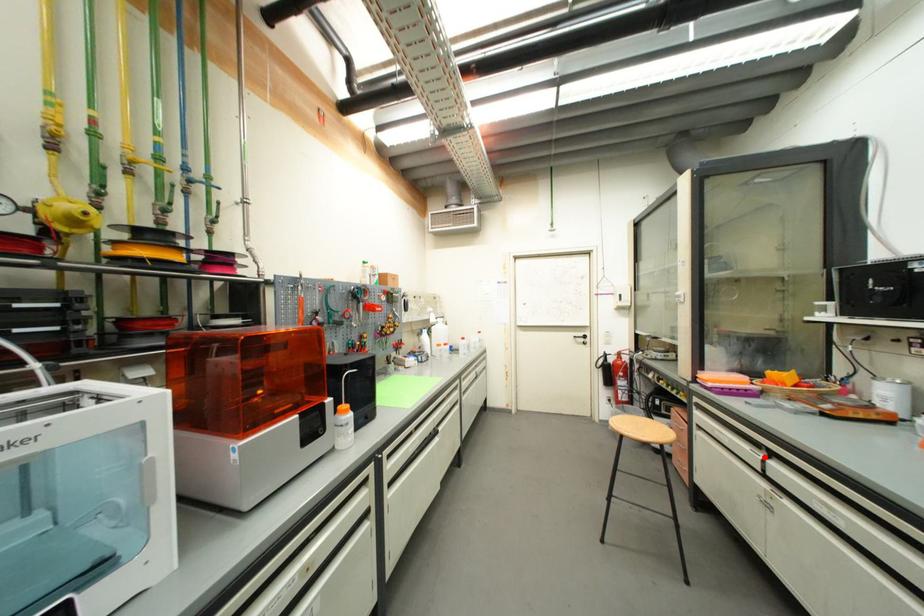
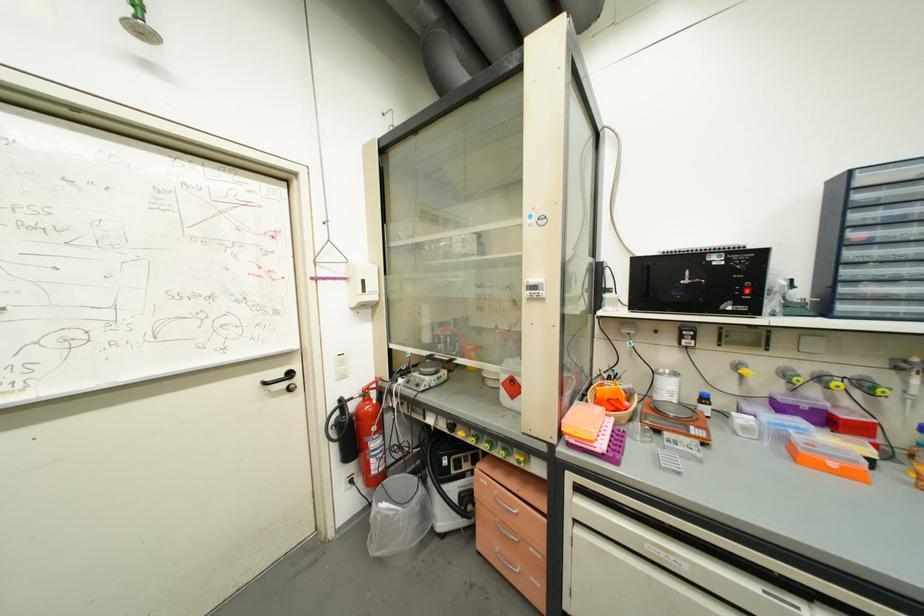
In the second image, find the point that corresponds to the highlighted location in the first image.

(803, 610)